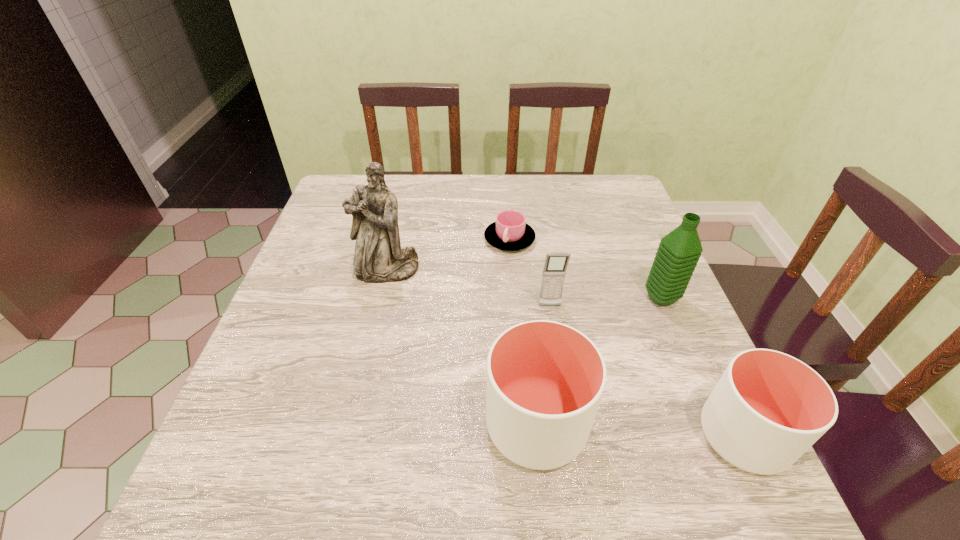
Where is `free region located on the side with the handle of the farthest cup`? free region located on the side with the handle of the farthest cup is located at coordinates (516, 318).

You are a GUI agent. You are given a task and a screenshot of the screen. Output one action in this format:
    pyautogui.click(x=<x>, y=<y>)
    Task: Click on the vacant space located 0.130m on the front-facing side of the second farthest object
    
    Given the screenshot: What is the action you would take?
    pyautogui.click(x=373, y=326)

Where is `vacant space situated 0.270m on the front of the second tallest object`? Image resolution: width=960 pixels, height=540 pixels. vacant space situated 0.270m on the front of the second tallest object is located at coordinates (713, 421).

This screenshot has width=960, height=540. I want to click on free region located 0.140m on the front-facing side of the cellular telephone, so click(x=559, y=361).

Locate an element on the screen. The image size is (960, 540). object present at the left edge is located at coordinates (378, 258).

Identify the location of cup present at the right edge. Image resolution: width=960 pixels, height=540 pixels. (768, 408).

The width and height of the screenshot is (960, 540). Find the location of `water bottle present at the right edge`. water bottle present at the right edge is located at coordinates (679, 251).

This screenshot has height=540, width=960. I want to click on object at the near right corner, so click(x=768, y=408).

Image resolution: width=960 pixels, height=540 pixels. Identify the location of vacant space at the far edge. (472, 207).

The image size is (960, 540). What are the coordinates of `free point at the near edge` in the screenshot? It's located at (353, 418).